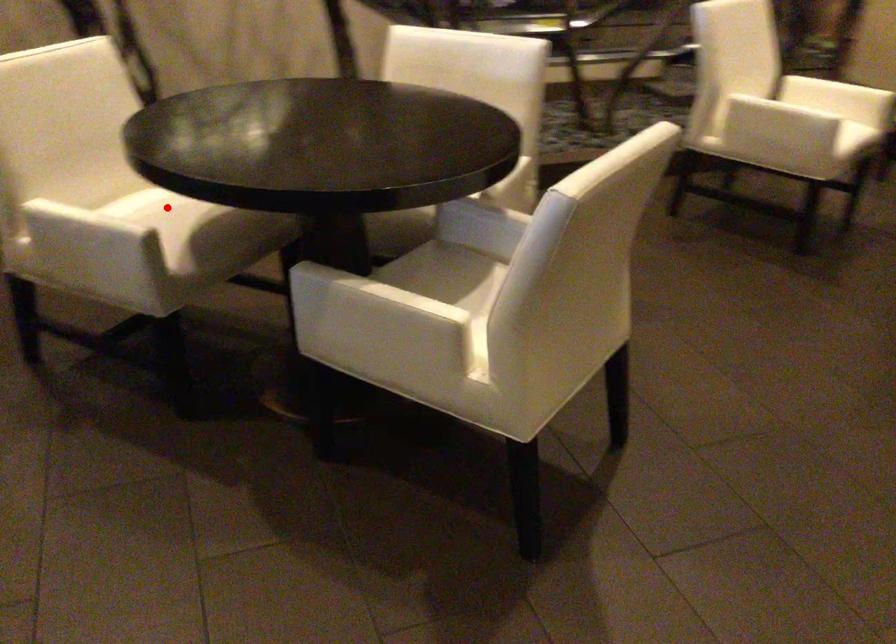
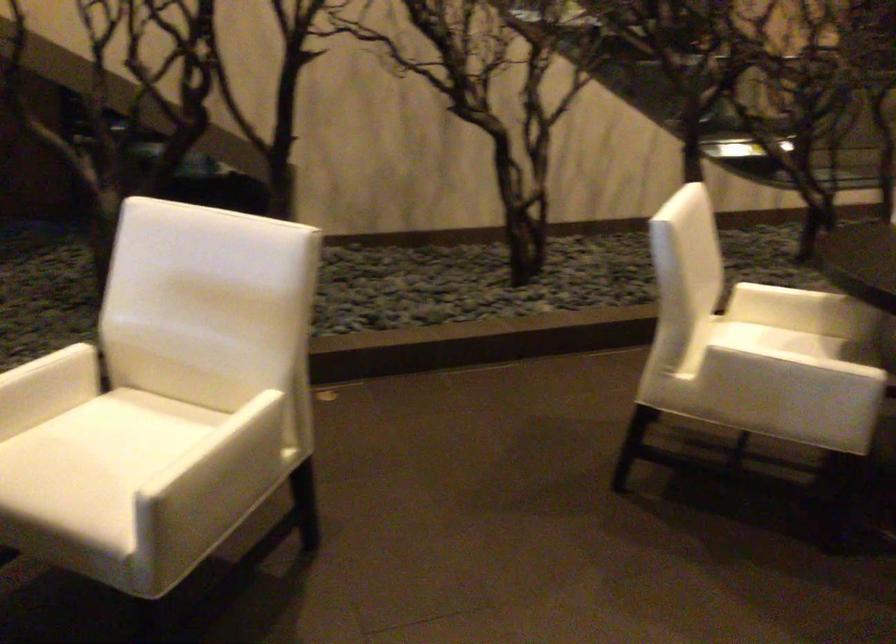
Locate, in the second image, the point that corresponds to the highlighted location in the first image.

(791, 341)